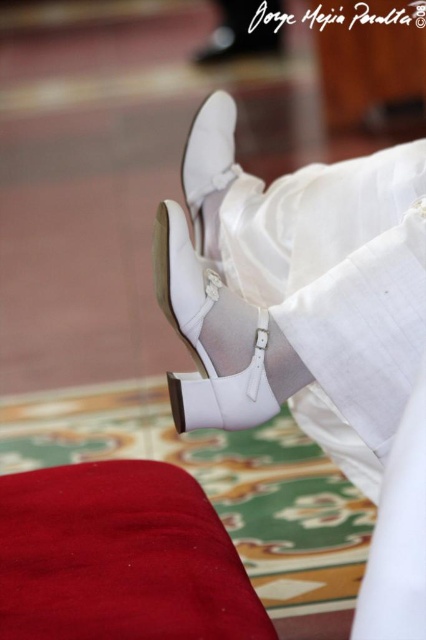
You are a photographer trying to capture the details of both the white leather sandal at center and the white leather shoe at center. Since you can only focus on one object at a time, which one should you focus on first to ensure the other is in the background?

The white leather sandal at center is in front of the white leather shoe at center, so focusing on the white leather sandal at center will place the white leather shoe at center in the background.

You are a photographer setting up a shoot in the scene described. You need to place a small prop exactly at the coordinates given for the white leather shoes at center. Where should you position the prop relative to the shoes?

The prop should be placed directly on top of the white leather shoes at center since the coordinates provided are for their exact location.

You are a photographer setting up a shoot in this scene. You need to place a small prop exactly at the coordinates mentioned in the description. Where should you place the prop to ensure it aligns with the red velvet mat at lower left?

You should place the prop at the coordinates point [120,557] to align it with the red velvet mat at lower left as specified in the description.